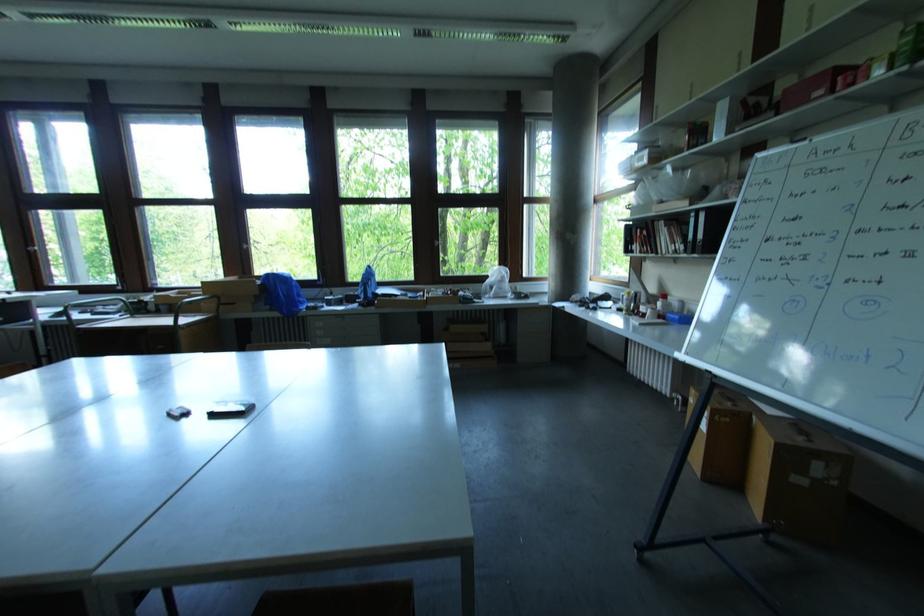
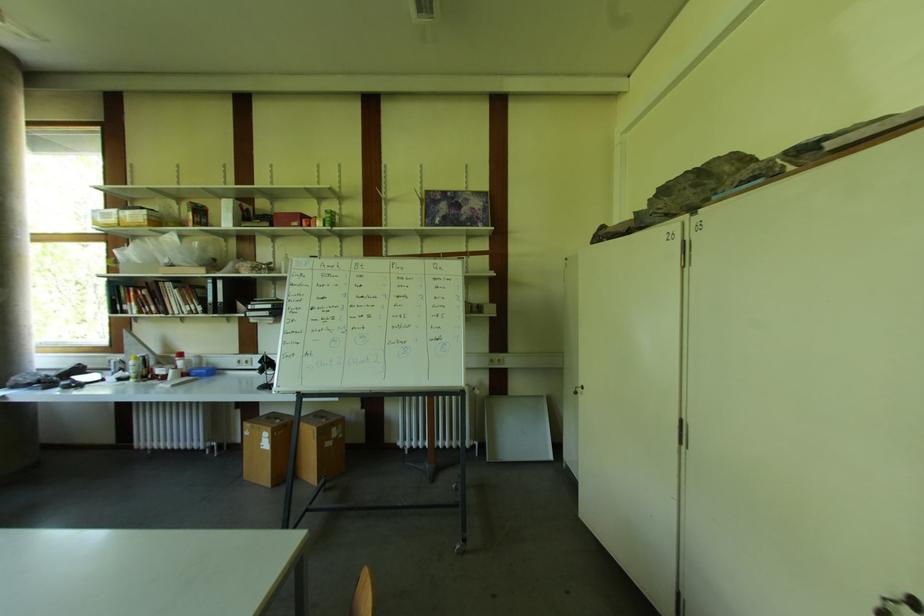
Find the pixel in the second image that matches (x=664, y=315) in the first image.

(188, 373)